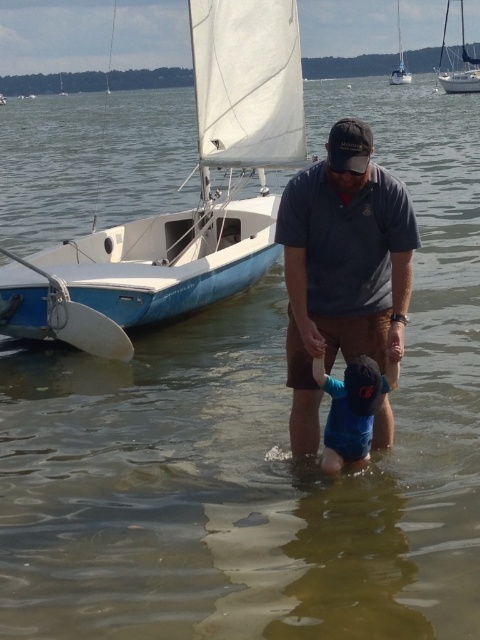
Question: Is blue matte sailboat at left to the right of white sailboat at upper center from the viewer's perspective?

Choices:
 (A) no
 (B) yes

Answer: (A)

Question: Which object appears closest to the camera in this image?

Choices:
 (A) blue cotton shirt at lower center
 (B) white sailboat at upper right
 (C) dark gray cotton shirt at center
 (D) white sailboat at upper center

Answer: (C)

Question: Observing the image, what is the correct spatial positioning of dark gray cotton shirt at center in reference to white sailboat at left?

Choices:
 (A) below
 (B) above

Answer: (A)

Question: Which point is farther to the camera?

Choices:
 (A) white sailboat at upper right
 (B) white sailboat at upper center
 (C) white sailboat at upper left

Answer: (C)

Question: Considering the real-world distances, which object is closest to the blue cotton shirt at lower center?

Choices:
 (A) dark gray cotton shirt at center
 (B) white sailboat at left

Answer: (A)

Question: Does white sailboat at upper right appear over white sailboat at upper center?

Choices:
 (A) no
 (B) yes

Answer: (A)